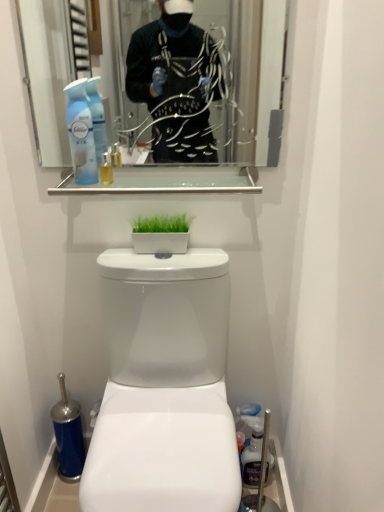
Image resolution: width=384 pixels, height=512 pixels. I want to click on vacant space that is to the left of white glossy planter at center, so click(128, 257).